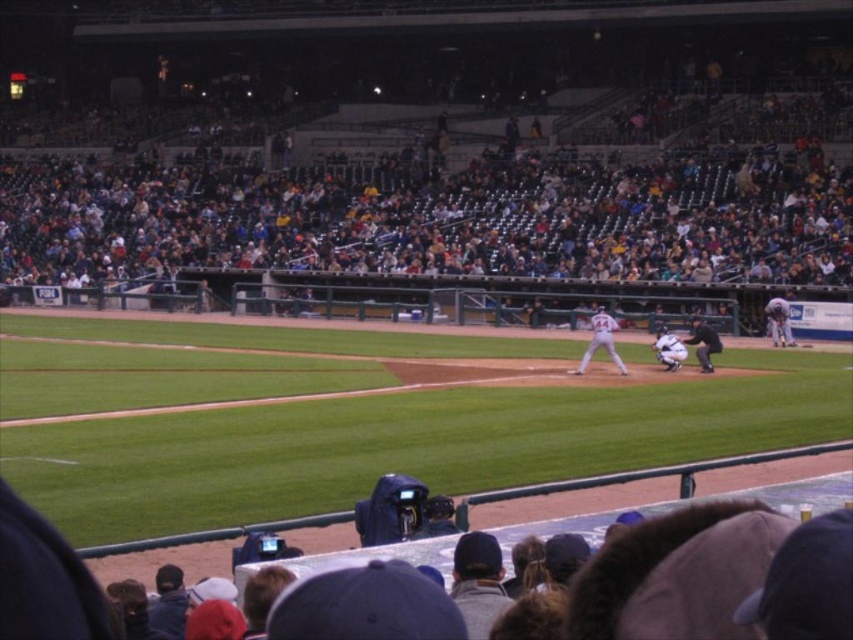
Between black uniform umpire at center and white matte uniform at center, which one has less height?

Standing shorter between the two is white matte uniform at center.

Who is more forward, (691, 336) or (672, 368)?

Point (672, 368)

Is point (705, 333) positioned in front of point (682, 346)?

No, it is behind (682, 346).

Locate an element on the screen. Image resolution: width=853 pixels, height=640 pixels. black uniform umpire at center is located at coordinates (703, 342).

Can you confirm if white uniform at center is bigger than white matte uniform at center?

Correct, white uniform at center is larger in size than white matte uniform at center.

Which of these two, white uniform at center or white matte uniform at center, stands taller?

white uniform at center is taller.

Where is `white uniform at center`? This screenshot has width=853, height=640. white uniform at center is located at coordinates (778, 321).

Locate an element on the screen. Image resolution: width=853 pixels, height=640 pixels. white uniform at center is located at coordinates (778, 321).

Is point (608, 346) more distant than point (670, 344)?

No, it is in front of (670, 344).

Is white uniform player at center above white matte uniform at center?

Yes, white uniform player at center is above white matte uniform at center.

At what (x,y) coordinates should I click in order to perform the action: click on white uniform player at center. Please return your answer as a coordinate pair (x, y). The width and height of the screenshot is (853, 640). Looking at the image, I should click on (601, 340).

Where is `white uniform player at center`? The height and width of the screenshot is (640, 853). white uniform player at center is located at coordinates (601, 340).